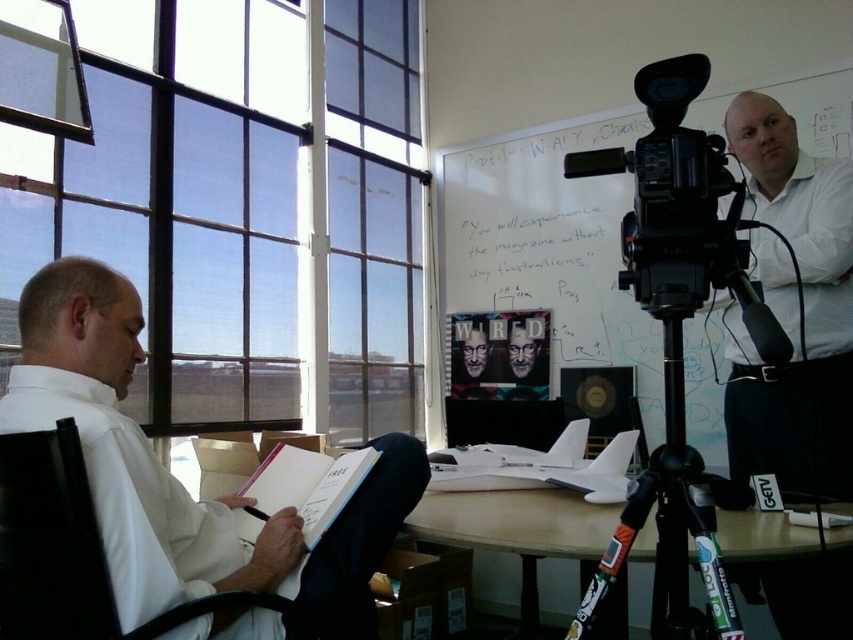
Question: Can you confirm if whiteboard at upper right is wider than wooden desk at center?

Choices:
 (A) no
 (B) yes

Answer: (B)

Question: Which of these objects is positioned closest to the whiteboard at upper right?

Choices:
 (A) white shirt at left
 (B) hardcover book at lower center
 (C) black plastic tripod at center
 (D) wooden desk at center

Answer: (D)

Question: Observing the image, what is the correct spatial positioning of wooden desk at center in reference to matte black glasses at center?

Choices:
 (A) right
 (B) left

Answer: (A)

Question: Considering the real-world distances, which object is closest to the whiteboard at upper right?

Choices:
 (A) black plastic tripod at center
 (B) white shirt at upper right
 (C) hardcover book at lower center

Answer: (B)

Question: Considering the relative positions of whiteboard at upper right and white shirt at upper right in the image provided, where is whiteboard at upper right located with respect to white shirt at upper right?

Choices:
 (A) left
 (B) right

Answer: (A)

Question: Which of the following is the closest to the observer?

Choices:
 (A) whiteboard at upper right
 (B) hardcover book at lower center

Answer: (B)